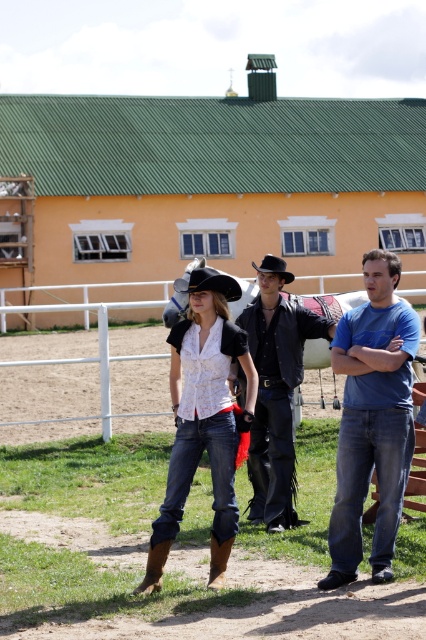
You are standing at the point marked as point (265, 374) and want to walk towards the nearest person. The distance from you to the nearest person is 10.16 meters. Can you reach them within 5 seconds if you walk at a speed of 2 meters per second?

The distance from point (265, 374) to the nearest person is 10.16 meters. Walking at 2 meters per second, it would take 5.08 seconds to reach them. Since 5.08 seconds is slightly more than 5 seconds, you cannot reach them within the time limit.

You are a photographer setting up a shoot at this ranch scene. You need to position a light source above the matte black cowboy hat at center so it casts a shadow on the brown leather cowboy boot at lower center. Is this possible given their positions?

The matte black cowboy hat at center is located above the brown leather cowboy boot at lower center, so positioning a light source above the hat would cast its shadow downward onto the boot.